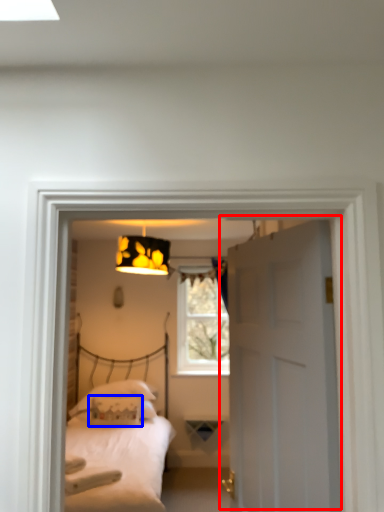
Question: Among these objects, which one is nearest to the camera, door (highlighted by a red box) or pillow (highlighted by a blue box)?

Choices:
 (A) door
 (B) pillow

Answer: (A)